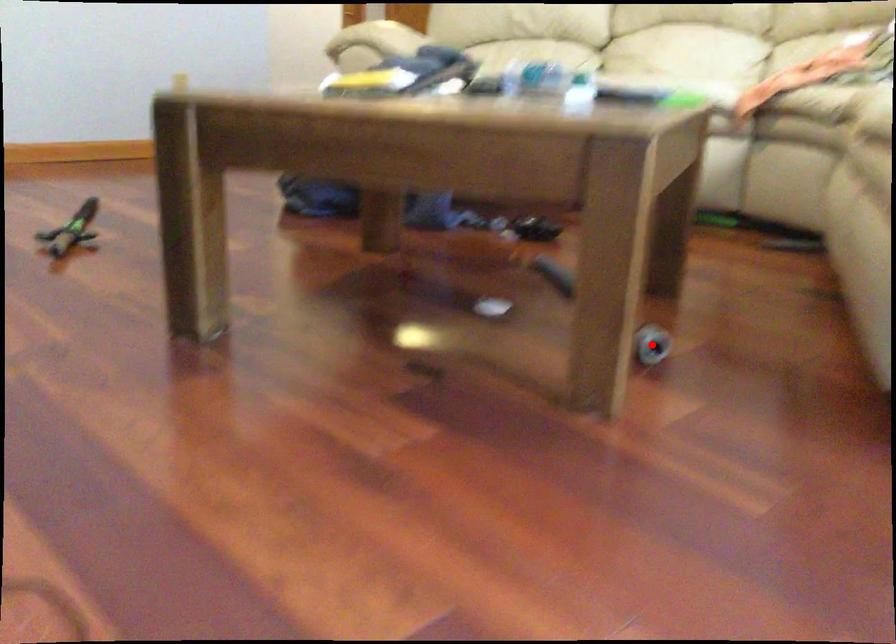
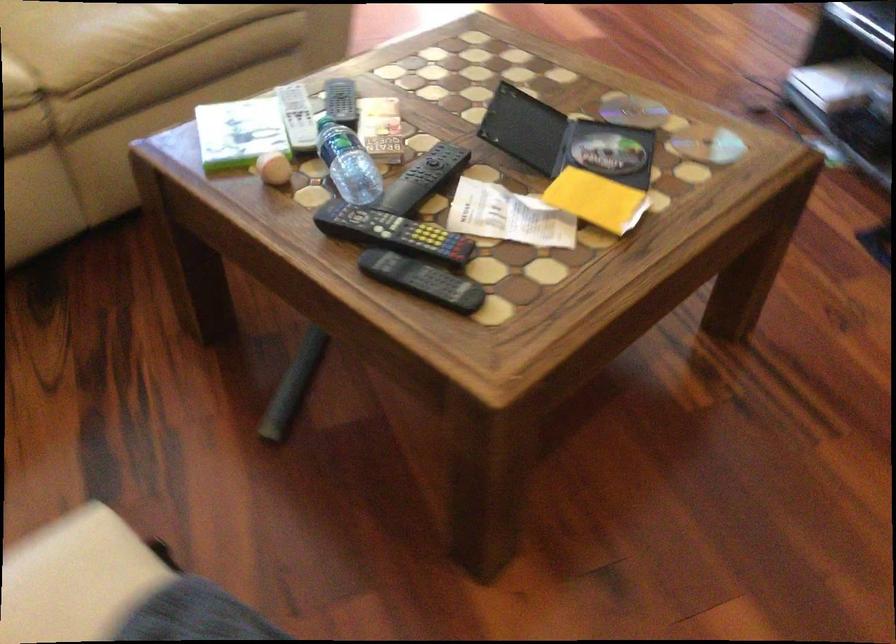
Question: I am providing you with two images of the same scene from different viewpoints. A red point is marked on the first image. Is the red point's position out of view in image 2?

Choices:
 (A) Yes
 (B) No

Answer: (A)